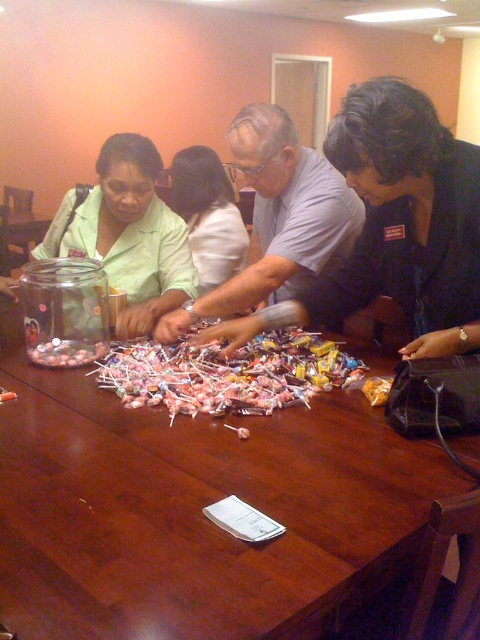
Does point (183, 582) lie behind point (269, 193)?

No, (183, 582) is closer to viewer.

Does wooden table at center have a lesser height compared to matte gray shirt at center?

Indeed, wooden table at center has a lesser height compared to matte gray shirt at center.

Where is `wooden table at center`? wooden table at center is located at coordinates (197, 513).

Based on the photo, who is more forward, (271, 150) or (222, 218)?

Point (271, 150) is more forward.

From the picture: Between matte gray shirt at center and white fabric shirt at center, which one has more height?

Standing taller between the two is white fabric shirt at center.

Describe the element at coordinates (277, 220) in the screenshot. I see `matte gray shirt at center` at that location.

This screenshot has height=640, width=480. Find the location of `matte gray shirt at center`. matte gray shirt at center is located at coordinates (277, 220).

Which is behind, point (201, 593) or point (154, 294)?

Point (154, 294)

Is wooden table at center shorter than matte green shirt at center?

Indeed, wooden table at center has a lesser height compared to matte green shirt at center.

Between point (109, 627) and point (86, 195), which one is positioned in front?

Point (109, 627) is more forward.

Where is `wooden table at center`? The image size is (480, 640). wooden table at center is located at coordinates (197, 513).